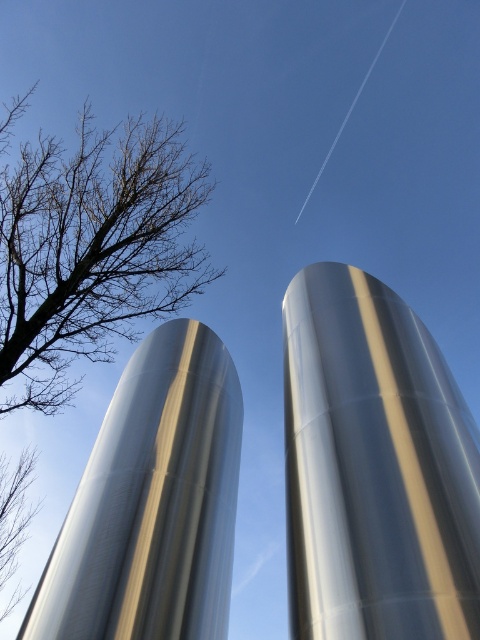
Question: Does polished metallic rocket at center appear on the right side of bare branches at left?

Choices:
 (A) no
 (B) yes

Answer: (B)

Question: Can you confirm if polished metallic rocket at center is positioned above bare branches at left?

Choices:
 (A) yes
 (B) no

Answer: (B)

Question: Estimate the real-world distances between objects in this image. Which object is farther from the silver metallic rocket at center?

Choices:
 (A) bare branches at left
 (B) polished metallic rocket at center

Answer: (A)

Question: Which is farther from the silver metallic rocket at center?

Choices:
 (A) bare branches at left
 (B) polished metallic rocket at center

Answer: (A)

Question: Observing the image, what is the correct spatial positioning of polished metallic rocket at center in reference to bare branches at left?

Choices:
 (A) left
 (B) right

Answer: (B)

Question: Which of the following is the closest to the observer?

Choices:
 (A) (231, 362)
 (B) (29, 340)

Answer: (A)